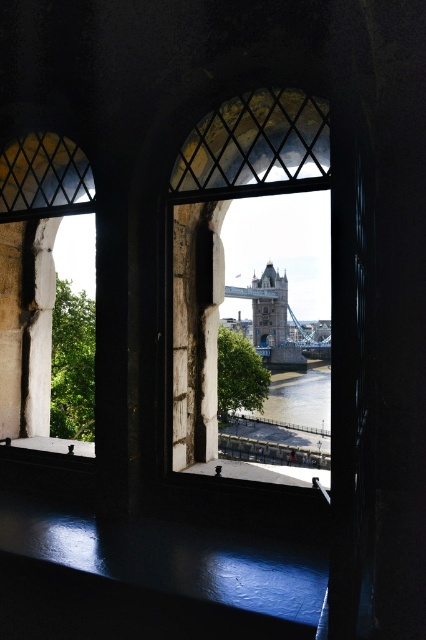
Question: Can you confirm if clear glass window at center is positioned to the right of brown water at lower center?

Choices:
 (A) no
 (B) yes

Answer: (A)

Question: Can you confirm if brown water at lower center is thinner than blue stone tower bridge at center?

Choices:
 (A) yes
 (B) no

Answer: (B)

Question: Which object appears closest to the camera in this image?

Choices:
 (A) matte stone window at left
 (B) clear glass window at center

Answer: (B)

Question: Does brown water at lower center appear on the left side of blue stone tower bridge at center?

Choices:
 (A) no
 (B) yes

Answer: (A)

Question: Which point is closer to the camera?

Choices:
 (A) (17, 317)
 (B) (264, 410)
 (C) (195, 461)

Answer: (C)

Question: Considering the real-world distances, which object is farthest from the clear glass window at center?

Choices:
 (A) blue stone tower bridge at center
 (B) brown water at lower center

Answer: (B)